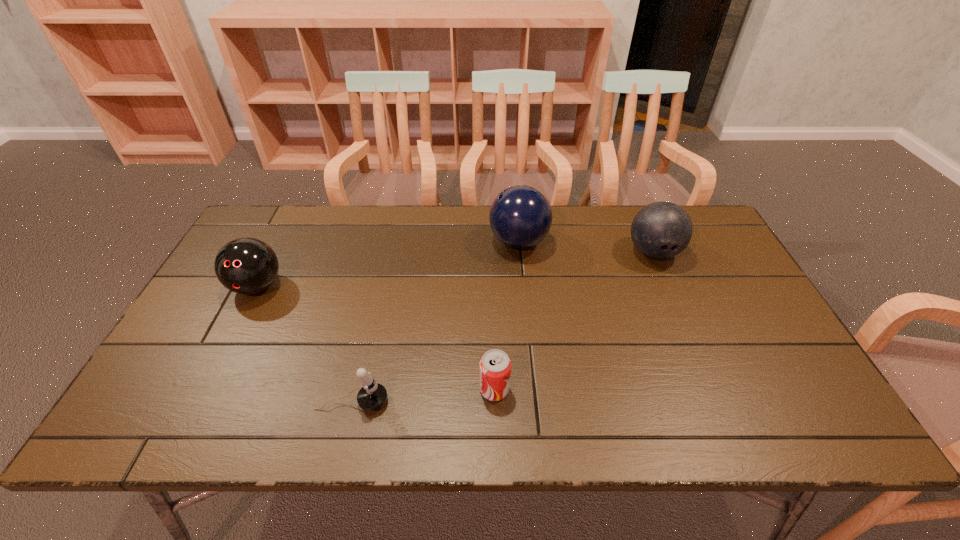
Where is `the second bowling ball from left to right`? This screenshot has height=540, width=960. the second bowling ball from left to right is located at coordinates (520, 216).

Identify the location of the rightmost object. This screenshot has height=540, width=960. (660, 230).

I want to click on the leftmost object, so click(x=246, y=265).

Find the location of a particular element. The height and width of the screenshot is (540, 960). the fourth object from right to left is located at coordinates (372, 396).

Locate an element on the screen. Image resolution: width=960 pixels, height=540 pixels. soda can is located at coordinates (495, 366).

Locate an element on the screen. vacant region located on the surface of the second bowling ball from left to right near the finger holes is located at coordinates (362, 241).

The height and width of the screenshot is (540, 960). What are the coordinates of `vacant area situated 0.070m on the surface of the second bowling ball from left to right near the finger holes` in the screenshot? It's located at (467, 241).

The image size is (960, 540). I want to click on free location located on the surface of the second bowling ball from left to right near the finger holes, so click(x=444, y=241).

Where is `free space located 0.100m on the grip area of the rightmost bowling ball`? The image size is (960, 540). free space located 0.100m on the grip area of the rightmost bowling ball is located at coordinates (672, 296).

At what (x,y) coordinates should I click in order to perform the action: click on vacant space located on the surface of the leftmost object near the finger holes. Please return your answer as a coordinate pair (x, y). Looking at the image, I should click on (240, 321).